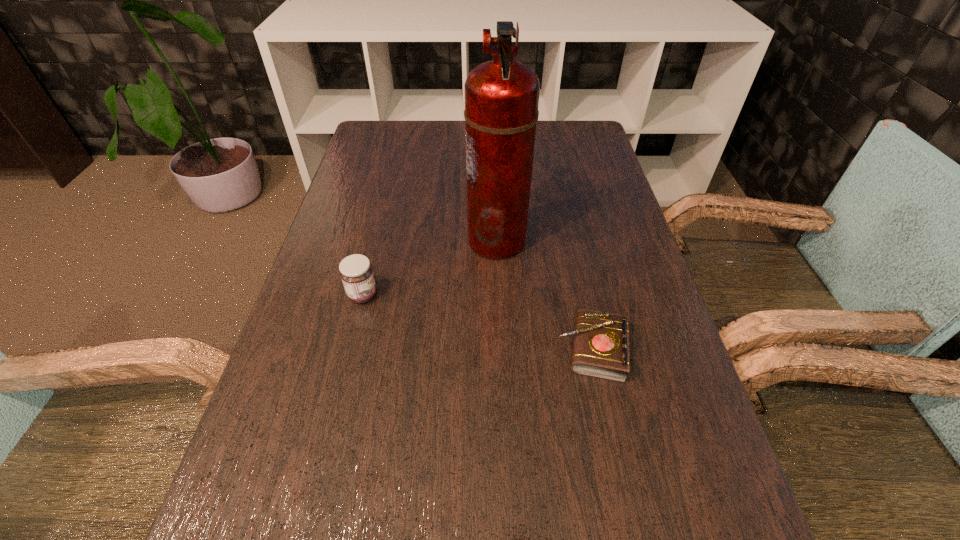
Identify the location of vacant region located 0.050m on the back of the diary. (582, 301).

This screenshot has width=960, height=540. I want to click on object that is at the left edge, so click(x=356, y=272).

At what (x,y) coordinates should I click in order to perform the action: click on object that is at the right edge. Please return your answer as a coordinate pair (x, y). The height and width of the screenshot is (540, 960). Looking at the image, I should click on (601, 339).

At what (x,y) coordinates should I click in order to perform the action: click on vacant point at the far edge. Please return your answer as a coordinate pair (x, y). Looking at the image, I should click on (538, 153).

This screenshot has width=960, height=540. In the image, there is a desktop. Identify the location of free space at the left edge. (313, 272).

The image size is (960, 540). I want to click on vacant space at the right edge, so click(x=590, y=273).

In the image, there is a desktop. Where is `blank space at the far left corner`? The image size is (960, 540). blank space at the far left corner is located at coordinates (397, 130).

You are a GUI agent. You are given a task and a screenshot of the screen. Output one action in this format:
    pyautogui.click(x=<x>, y=<y>)
    Task: Click on the vacant region at the far right corner of the desktop
    This screenshot has width=960, height=540.
    Given the screenshot: What is the action you would take?
    pyautogui.click(x=574, y=126)

Where is `free space between the jam and the rightmost object`? This screenshot has height=540, width=960. free space between the jam and the rightmost object is located at coordinates (477, 322).

Where is `vacant area that lies between the fire extinguisher and the shortest object`? The width and height of the screenshot is (960, 540). vacant area that lies between the fire extinguisher and the shortest object is located at coordinates (544, 295).